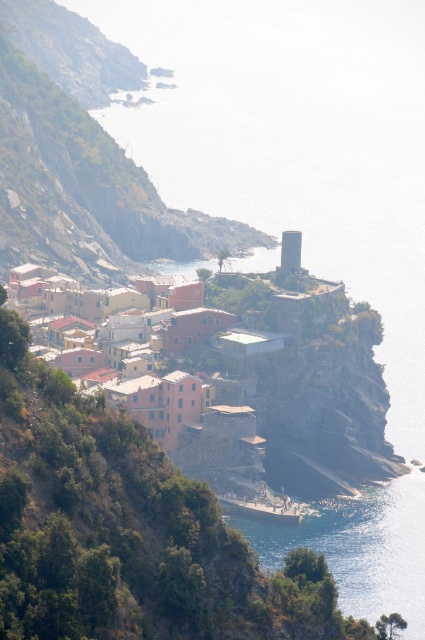
Question: Which of the following is the closest to the observer?

Choices:
 (A) (98, 144)
 (B) (184, 372)

Answer: (B)

Question: Does rustic stone buildings at center lie behind matte pink buildings at center?

Choices:
 (A) yes
 (B) no

Answer: (A)

Question: Does rustic stone buildings at center have a greater width compared to matte pink buildings at center?

Choices:
 (A) no
 (B) yes

Answer: (B)

Question: Among these points, which one is farthest from the camera?

Choices:
 (A) (192, 220)
 (B) (73, 369)

Answer: (A)

Question: Which point appears closest to the camera in this image?

Choices:
 (A) (125, 387)
 (B) (19, 38)

Answer: (A)

Question: Does rustic stone buildings at center come behind matte pink buildings at center?

Choices:
 (A) yes
 (B) no

Answer: (A)